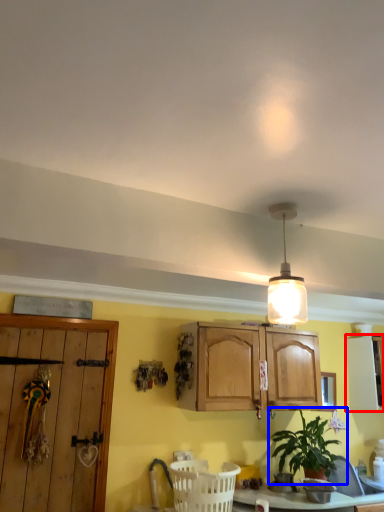
Question: Which object is closer to the camera taking this photo, cabinetry (highlighted by a red box) or houseplant (highlighted by a blue box)?

Choices:
 (A) cabinetry
 (B) houseplant

Answer: (B)